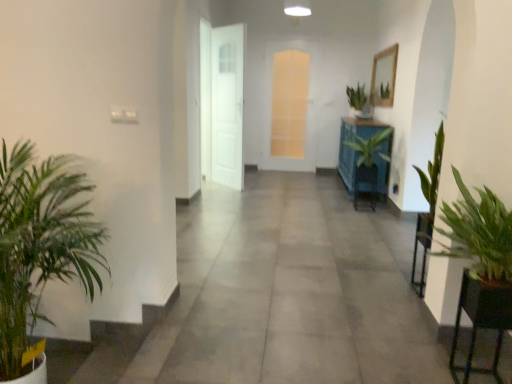
Question: Is green leafy plant at left, the first houseplant positioned from the left, looking in the opposite direction of green glossy plant at center, positioned as the 2th houseplant in back-to-front order?

Choices:
 (A) no
 (B) yes

Answer: (A)

Question: Would you consider green leafy plant at left, marked as the first houseplant in a front-to-back arrangement, to be distant from green glossy plant at center, marked as the 3th houseplant in a front-to-back arrangement?

Choices:
 (A) yes
 (B) no

Answer: (A)

Question: From a real-world perspective, is green leafy plant at left, the 4th houseplant in the back-to-front sequence, located beneath green glossy plant at center, marked as the 3th houseplant in a front-to-back arrangement?

Choices:
 (A) no
 (B) yes

Answer: (B)

Question: Is green leafy plant at left, marked as the first houseplant in a front-to-back arrangement, positioned before green glossy plant at center, positioned as the 2th houseplant in back-to-front order?

Choices:
 (A) yes
 (B) no

Answer: (A)

Question: Is green leafy plant at left, the first houseplant positioned from the left, in contact with green glossy plant at center, positioned as the 2th houseplant in back-to-front order?

Choices:
 (A) no
 (B) yes

Answer: (A)

Question: In terms of size, does translucent glass door at center, the 2th door when ordered from left to right, appear bigger or smaller than white glossy door at center, marked as the 2th door in a right-to-left arrangement?

Choices:
 (A) small
 (B) big

Answer: (A)

Question: From a real-world perspective, is translucent glass door at center, the 2th door when ordered from left to right, positioned above or below white glossy door at center, the 2th door in the back-to-front sequence?

Choices:
 (A) below
 (B) above

Answer: (B)

Question: In terms of width, does translucent glass door at center, the 1th door when ordered from back to front, look wider or thinner when compared to white glossy door at center, the 2th door in the back-to-front sequence?

Choices:
 (A) wide
 (B) thin

Answer: (B)

Question: Relative to white glossy door at center, marked as the 2th door in a right-to-left arrangement, is translucent glass door at center, the 1th door when ordered from back to front, in front or behind?

Choices:
 (A) front
 (B) behind

Answer: (B)

Question: Considering their positions, is white glossy door at center, which ranks as the 1th door in front-to-back order, located in front of or behind green leafy plant at right?

Choices:
 (A) behind
 (B) front

Answer: (A)

Question: From a real-world perspective, is white glossy door at center, which is counted as the 1th door, starting from the left, positioned above or below green leafy plant at right?

Choices:
 (A) above
 (B) below

Answer: (A)

Question: Is point click(224, 150) closer or farther from the camera than point click(486, 326)?

Choices:
 (A) closer
 (B) farther

Answer: (B)

Question: From the image's perspective, is white glossy door at center, marked as the 2th door in a right-to-left arrangement, positioned above or below green leafy plant at right?

Choices:
 (A) below
 (B) above

Answer: (B)

Question: Is green leafy plant at left spatially inside green leafy plant at left, marked as the first houseplant in a front-to-back arrangement, or outside of it?

Choices:
 (A) inside
 (B) outside

Answer: (B)

Question: Considering the positions of point (389, 331) and point (98, 225), is point (389, 331) closer or farther from the camera than point (98, 225)?

Choices:
 (A) farther
 (B) closer

Answer: (A)